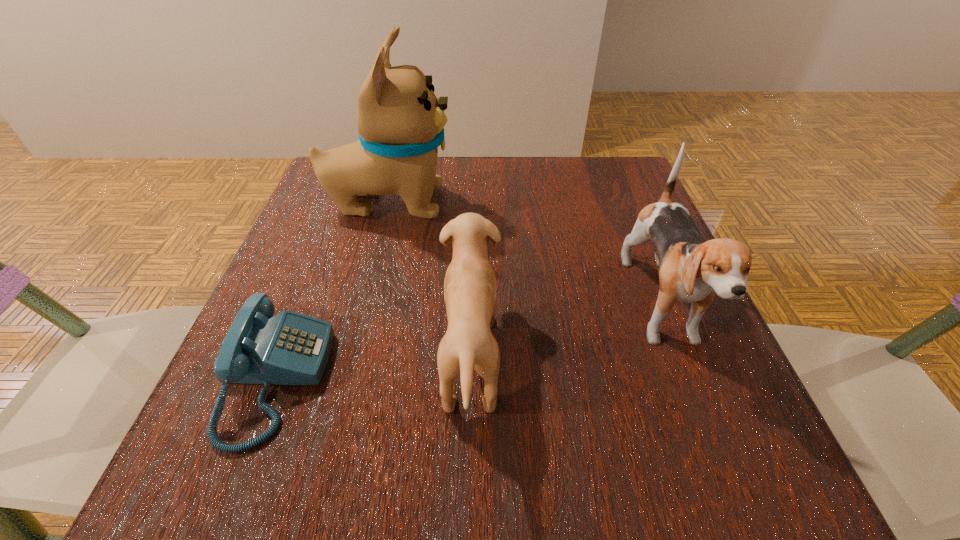
The width and height of the screenshot is (960, 540). What are the coordinates of `vacant space that satisfies the following two spatial constraints: 1. at the face of the second shortest puppy; 2. on the dial of the telephone` in the screenshot? It's located at (689, 380).

You are a GUI agent. You are given a task and a screenshot of the screen. Output one action in this format:
    pyautogui.click(x=<x>, y=<y>)
    Task: Click on the vacant space that satisfies the following two spatial constraints: 1. at the face of the second tallest object; 2. on the left side of the second shortest object
    This screenshot has height=540, width=960.
    Given the screenshot: What is the action you would take?
    pyautogui.click(x=681, y=357)